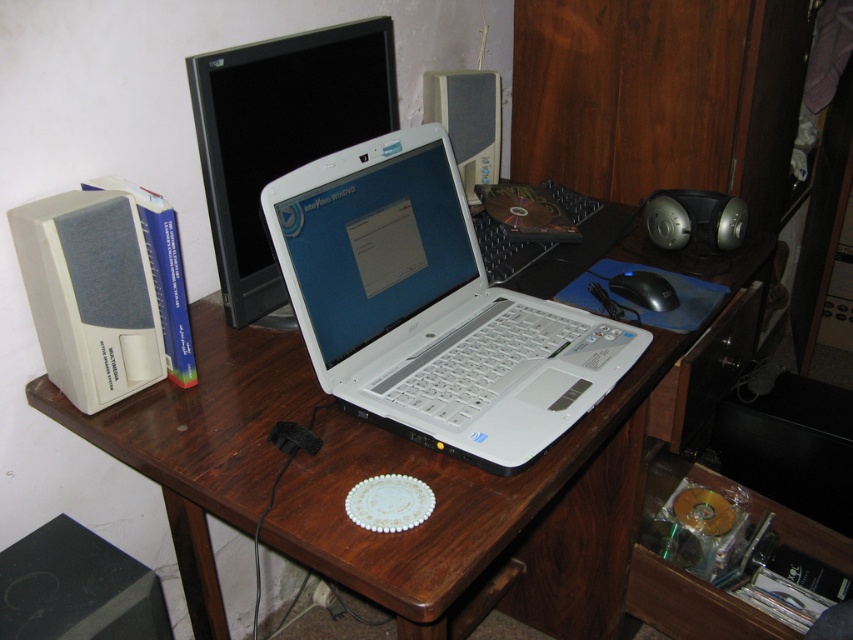
Question: Is white plastic laptop at center bigger than white matte speaker at left?

Choices:
 (A) no
 (B) yes

Answer: (B)

Question: Considering the real-world distances, which object is closest to the wooden desk at center?

Choices:
 (A) white matte speaker at left
 (B) matte gray speaker at center
 (C) white plastic laptop at center
 (D) black glossy monitor at upper center

Answer: (C)

Question: Which of the following is the closest to the observer?

Choices:
 (A) (258, 65)
 (B) (447, 113)
 (C) (648, 292)
 (D) (97, 214)

Answer: (D)

Question: Does white plastic laptop at center appear over matte gray speaker at center?

Choices:
 (A) yes
 (B) no

Answer: (B)

Question: Is white matte speaker at left smaller than matte gray speaker at center?

Choices:
 (A) yes
 (B) no

Answer: (A)

Question: Which of these objects is positioned farthest from the black glossy monitor at upper center?

Choices:
 (A) white plastic laptop at center
 (B) black plastic mouse at lower right

Answer: (B)